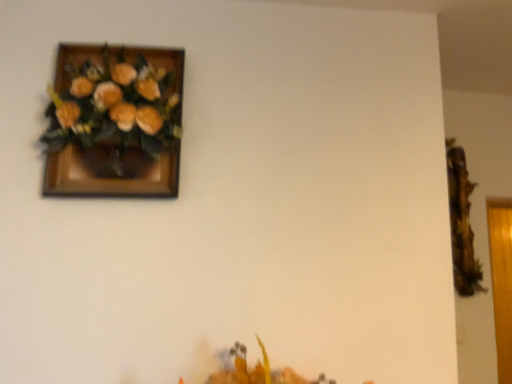
What are the coordinates of `wooden frame at upper left` in the screenshot? It's located at (114, 122).

What do you see at coordinates (114, 122) in the screenshot? I see `wooden frame at upper left` at bounding box center [114, 122].

Image resolution: width=512 pixels, height=384 pixels. Identify the location of wooden frame at upper left. (114, 122).